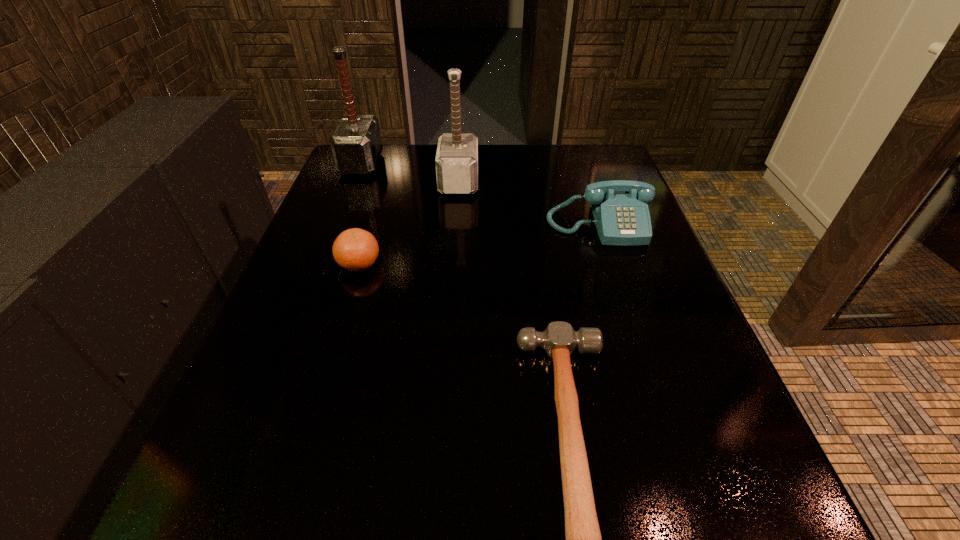
This screenshot has height=540, width=960. I want to click on hammer that stands as the second closest to the telephone, so click(x=583, y=538).

Find the location of a particular element. The height and width of the screenshot is (540, 960). free space that satisfies the following two spatial constraints: 1. on the front side of the leftmost hammer; 2. on the right side of the fourth tallest object is located at coordinates (322, 264).